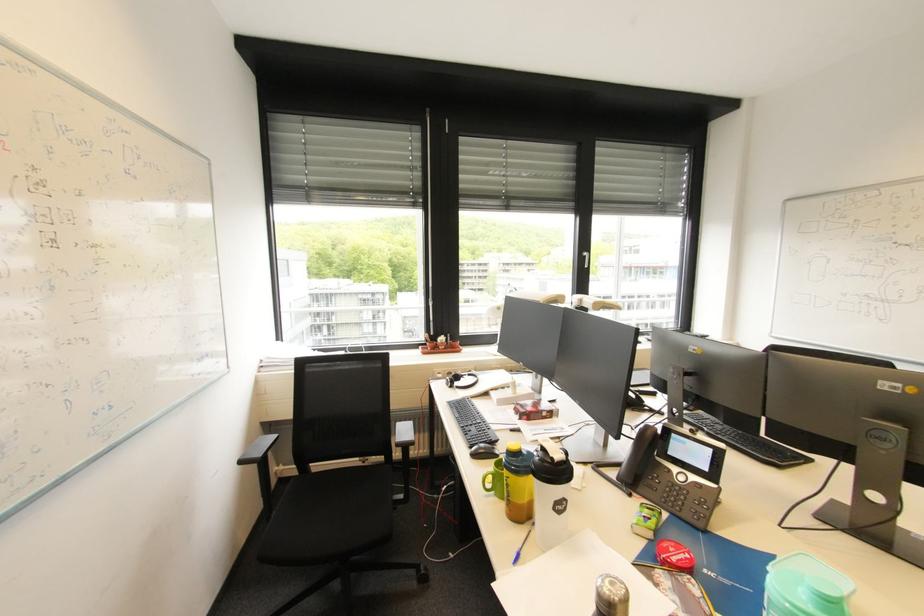
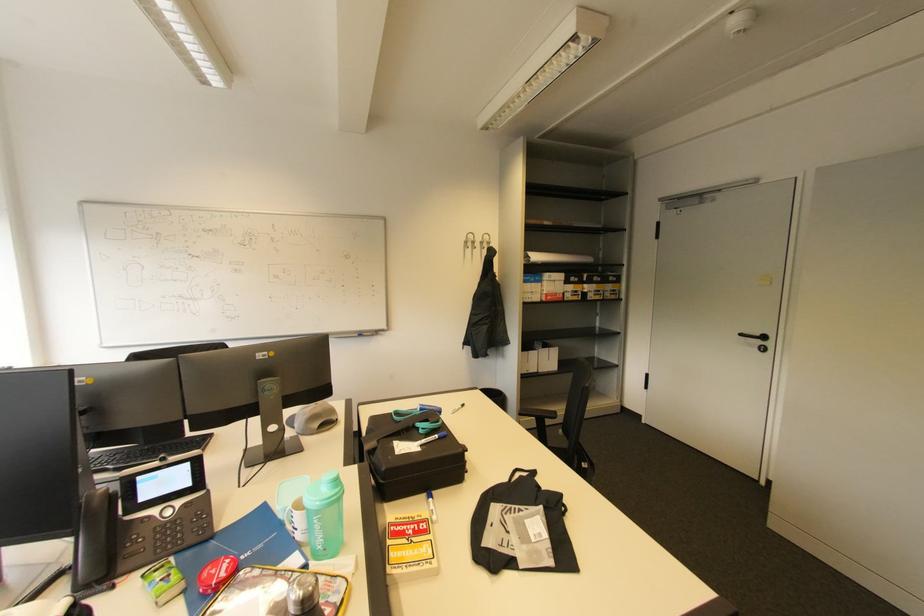
Locate, in the second image, the point that corresponds to point 651,543 in the first image.

(187, 597)